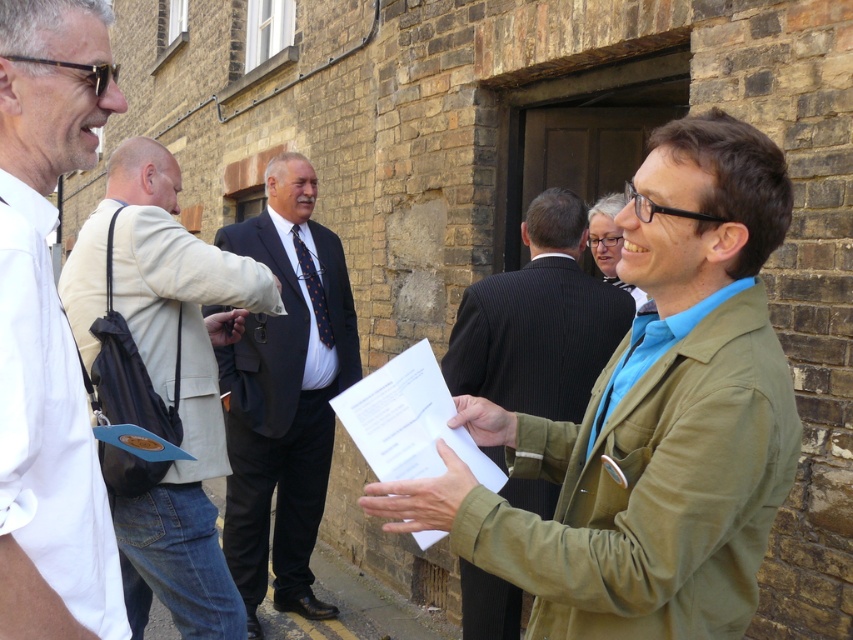
Question: Which point is closer to the camera?

Choices:
 (A) olive-green fabric jacket at center-right
 (B) dark blue suit at center
 (C) green textured jacket at center
 (D) light beige jacket at center

Answer: (A)

Question: Can you confirm if olive-green fabric jacket at center-right is positioned above white shirt at left?

Choices:
 (A) no
 (B) yes

Answer: (A)

Question: Considering the relative positions of olive-green fabric jacket at center-right and dark blue suit at center in the image provided, where is olive-green fabric jacket at center-right located with respect to dark blue suit at center?

Choices:
 (A) below
 (B) above

Answer: (B)

Question: Which point appears closest to the camera in this image?

Choices:
 (A) click(x=540, y=488)
 (B) click(x=721, y=353)
 (C) click(x=235, y=429)
 (D) click(x=169, y=275)

Answer: (B)

Question: Is olive-green fabric jacket at center-right above dark blue suit at center?

Choices:
 (A) yes
 (B) no

Answer: (A)

Question: Among these points, which one is farthest from the camera?

Choices:
 (A) (674, 516)
 (B) (155, 221)
 (C) (531, 273)

Answer: (C)